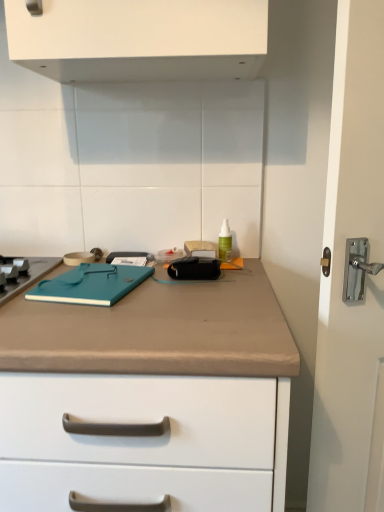
Question: Does beige matte countertop at center have a lesser width compared to green translucent bottle at center?

Choices:
 (A) yes
 (B) no

Answer: (B)

Question: Does beige matte countertop at center have a lesser height compared to green translucent bottle at center?

Choices:
 (A) no
 (B) yes

Answer: (A)

Question: Is green translucent bottle at center a part of beige matte countertop at center?

Choices:
 (A) no
 (B) yes

Answer: (A)

Question: From a real-world perspective, is beige matte countertop at center located higher than green translucent bottle at center?

Choices:
 (A) yes
 (B) no

Answer: (B)

Question: Considering the relative sizes of beige matte countertop at center and green translucent bottle at center in the image provided, is beige matte countertop at center wider than green translucent bottle at center?

Choices:
 (A) yes
 (B) no

Answer: (A)

Question: Would you say beige matte countertop at center is outside green translucent bottle at center?

Choices:
 (A) no
 (B) yes

Answer: (B)

Question: Does teal matte notebook at center appear on the right side of beige matte countertop at center?

Choices:
 (A) yes
 (B) no

Answer: (A)

Question: Are teal matte notebook at center and beige matte countertop at center located far from each other?

Choices:
 (A) no
 (B) yes

Answer: (A)

Question: Can you see teal matte notebook at center touching beige matte countertop at center?

Choices:
 (A) no
 (B) yes

Answer: (A)

Question: Can you confirm if teal matte notebook at center is shorter than beige matte countertop at center?

Choices:
 (A) yes
 (B) no

Answer: (A)

Question: From a real-world perspective, does teal matte notebook at center sit lower than beige matte countertop at center?

Choices:
 (A) no
 (B) yes

Answer: (A)

Question: Is the depth of teal matte notebook at center less than that of beige matte countertop at center?

Choices:
 (A) yes
 (B) no

Answer: (B)

Question: Is teal matte notebook at center shorter than green translucent bottle at center?

Choices:
 (A) yes
 (B) no

Answer: (A)